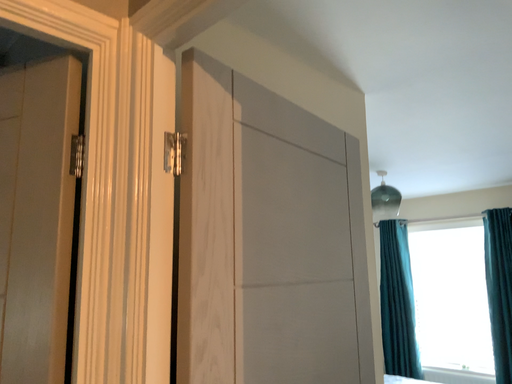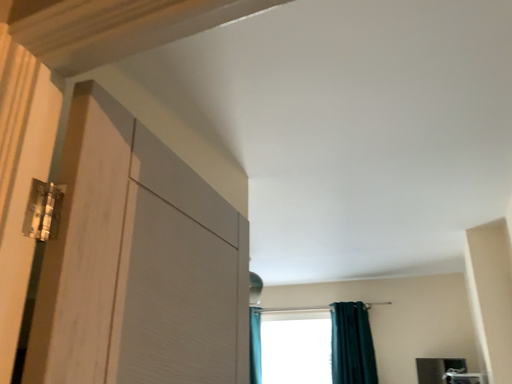
Question: How did the camera likely rotate when shooting the video?

Choices:
 (A) rotated upward
 (B) rotated downward

Answer: (A)